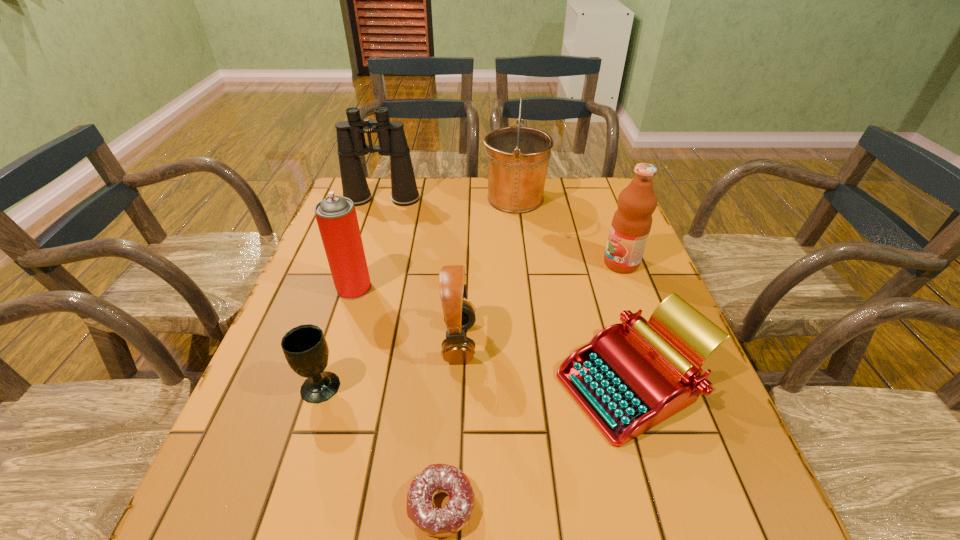
Locate an element on the screen. vacant area situated on the front label of the sixth nearest object is located at coordinates (467, 264).

I want to click on free space located 0.050m on the front label of the sixth nearest object, so click(x=585, y=264).

Where is `vacant space located on the right of the aerosol can`? This screenshot has height=540, width=960. vacant space located on the right of the aerosol can is located at coordinates (509, 288).

The image size is (960, 540). What are the coordinates of `vacant area situated on the ear cups of the fifth tallest object` in the screenshot? It's located at (597, 342).

Locate an element on the screen. Image resolution: width=960 pixels, height=540 pixels. free spot located on the back of the chalice is located at coordinates (356, 276).

Identify the location of free space located 0.390m on the typing side of the typewriter. This screenshot has width=960, height=540. (366, 384).

At what (x,y) coordinates should I click in order to perform the action: click on vacant space located 0.050m on the typing side of the typewriter. Please return your answer as a coordinate pair (x, y). This screenshot has height=540, width=960. Looking at the image, I should click on (533, 384).

Locate an element on the screen. The width and height of the screenshot is (960, 540). vacant space located on the typing side of the typewriter is located at coordinates (415, 384).

Image resolution: width=960 pixels, height=540 pixels. I want to click on bucket that is at the far edge, so click(x=518, y=156).

Identify the location of binoculars at the far edge. (351, 142).